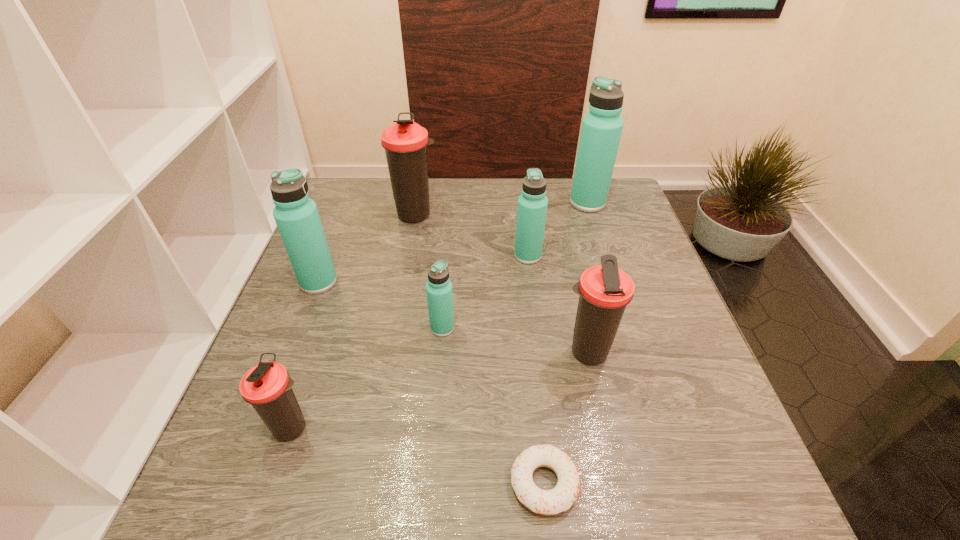
The image size is (960, 540). I want to click on vacant space in between the nearest aqua thermos bottle and the leftmost aqua thermos bottle, so click(x=380, y=305).

Image resolution: width=960 pixels, height=540 pixels. I want to click on free space between the second smallest brown thermos bottle and the white doughnut, so click(565, 418).

Select which object appears as the second closest to the third object from left to right. Please provide its 2D coordinates. Your answer should be formatted as a tuple, i.e. [(x, y)], where the tuple contains the x and y coordinates of a point satisfying the conditions above.

[(532, 206)]

Choose which object is the sixth nearest neighbor to the third farthest object. Please provide its 2D coordinates. Your answer should be formatted as a tuple, i.e. [(x, y)], where the tuple contains the x and y coordinates of a point satisfying the conditions above.

[(546, 502)]

You are a GUI agent. You are given a task and a screenshot of the screen. Output one action in this format:
    pyautogui.click(x=<x>, y=<y>)
    Task: Click on the closest thermos bottle to the second nearest brown thermos bottle
    The image size is (960, 540).
    Given the screenshot: What is the action you would take?
    pyautogui.click(x=439, y=292)

Find the location of a particular element. This screenshot has width=960, height=540. thermos bottle that stands as the fifth closest to the nearest brown thermos bottle is located at coordinates (405, 142).

The height and width of the screenshot is (540, 960). I want to click on aqua thermos bottle object that ranks as the third closest to the doughnut, so click(297, 218).

You are a GUI agent. You are given a task and a screenshot of the screen. Output one action in this format:
    pyautogui.click(x=<x>, y=<y>)
    Task: Click on the aqua thermos bottle that is the second closest to the fourth farthest thermos bottle
    This screenshot has height=540, width=960.
    Given the screenshot: What is the action you would take?
    pyautogui.click(x=532, y=206)

Where is `brown thermos bottle object that ranks as the second closest to the nearest brown thermos bottle`? This screenshot has height=540, width=960. brown thermos bottle object that ranks as the second closest to the nearest brown thermos bottle is located at coordinates (405, 142).

Where is `the second closest brown thermos bottle relative to the third object from left to right`? Image resolution: width=960 pixels, height=540 pixels. the second closest brown thermos bottle relative to the third object from left to right is located at coordinates (267, 386).